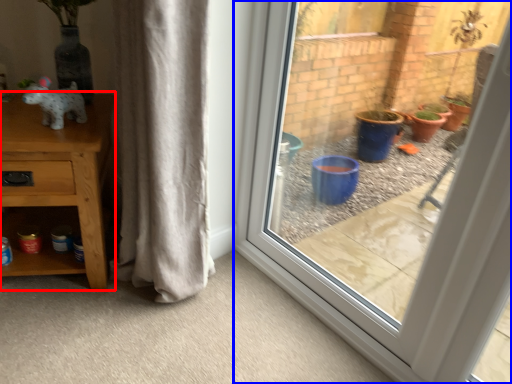
Question: Which object appears farthest to the camera in this image, furniture (highlighted by a red box) or window (highlighted by a blue box)?

Choices:
 (A) furniture
 (B) window

Answer: (A)